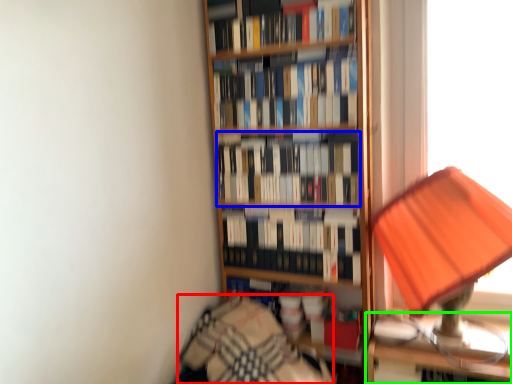
Question: Estimate the real-world distances between objects in this image. Which object is farther from bedding (highlighted by a red box), book (highlighted by a blue box) or table (highlighted by a green box)?

Choices:
 (A) book
 (B) table

Answer: (A)